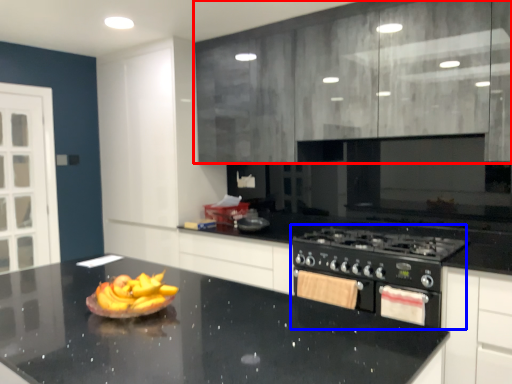
Question: Which object is further to the camera taking this photo, cabinetry (highlighted by a red box) or appliance (highlighted by a blue box)?

Choices:
 (A) cabinetry
 (B) appliance

Answer: (B)